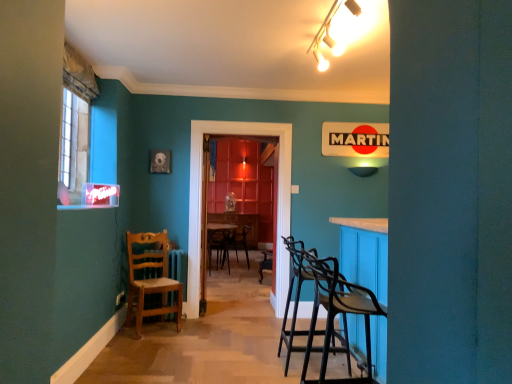
This screenshot has height=384, width=512. Find the location of `free spot below wooden chair at left (from a real-world perspective)`. free spot below wooden chair at left (from a real-world perspective) is located at coordinates (155, 325).